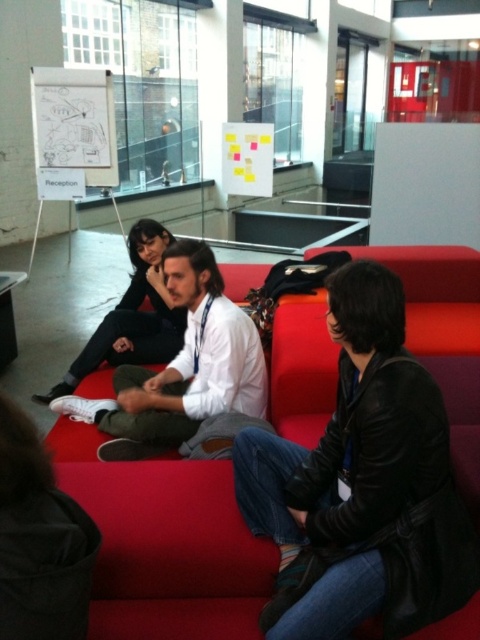
You are standing at the point labeled as point (456, 358) in a modern office with large glass windows. You want to take a photo of the entire room without moving your position. Given that your camera has a 90 degree field of view, will you be able to capture the entire room in one shot?

The point (456, 358) and camera are 8.10 feet apart from each other. Since the camera has a 90 degree field of view, it can capture a wide angle, but whether it can capture the entire room depends on the room dimensions. However, the provided information does not specify the room size or layout beyond the couch and windows. Without knowing the room dimensions, it is impossible to determine if the entire room can be captured in one shot.

You are a photographer setting up a camera to take a group photo of the three people on the couch. The camera has a minimum focus distance of 12 inches. Will the two people wearing the white matte shirt at center and the matte black jacket at center be in focus if you position the camera at the same distance as their separation?

The white matte shirt at center and matte black jacket at center are 14.09 inches apart. Since the camera requires a minimum focus distance of 12 inches, positioning the camera at 14.09 inches away would exceed the minimum requirement, so both subjects should be in focus.